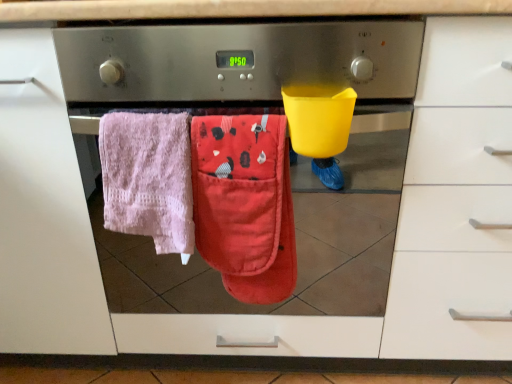
Describe the element at coordinates (244, 204) in the screenshot. I see `red cotton oven mitt at center, arranged as the first beach towel when viewed from the right` at that location.

In order to click on red cotton oven mitt at center, arranged as the first beach towel when viewed from the right in this screenshot , I will do `click(244, 204)`.

Based on the photo, measure the distance between pink terry cloth towel at left, marked as the 1th beach towel in a left-to-right arrangement, and camera.

pink terry cloth towel at left, marked as the 1th beach towel in a left-to-right arrangement, is 27.11 inches from camera.

What do you see at coordinates (148, 178) in the screenshot? I see `pink terry cloth towel at left, arranged as the second beach towel when viewed from the right` at bounding box center [148, 178].

The width and height of the screenshot is (512, 384). What are the coordinates of `pink terry cloth towel at left, marked as the 1th beach towel in a left-to-right arrangement` in the screenshot? It's located at (148, 178).

What is the approximate height of pink terry cloth towel at left, marked as the 1th beach towel in a left-to-right arrangement?

11.25 inches.

Where is `red cotton oven mitt at center, arranged as the first beach towel when viewed from the right`? red cotton oven mitt at center, arranged as the first beach towel when viewed from the right is located at coordinates (244, 204).

Considering the relative positions of red cotton oven mitt at center, arranged as the first beach towel when viewed from the right, and pink terry cloth towel at left, marked as the 1th beach towel in a left-to-right arrangement, in the image provided, is red cotton oven mitt at center, arranged as the first beach towel when viewed from the right, to the right of pink terry cloth towel at left, marked as the 1th beach towel in a left-to-right arrangement, from the viewer's perspective?

Indeed, red cotton oven mitt at center, arranged as the first beach towel when viewed from the right, is positioned on the right side of pink terry cloth towel at left, marked as the 1th beach towel in a left-to-right arrangement.

Is red cotton oven mitt at center, arranged as the first beach towel when viewed from the right, further to the viewer compared to pink terry cloth towel at left, arranged as the second beach towel when viewed from the right?

Yes, red cotton oven mitt at center, arranged as the first beach towel when viewed from the right, is further from the viewer.

Is point (270, 210) positioned before point (145, 163)?

That is False.

From the image's perspective, which is below, red cotton oven mitt at center, placed as the 2th beach towel when sorted from left to right, or pink terry cloth towel at left, arranged as the second beach towel when viewed from the right?

red cotton oven mitt at center, placed as the 2th beach towel when sorted from left to right, is shown below in the image.

From a real-world perspective, which object stands above the other?

pink terry cloth towel at left, arranged as the second beach towel when viewed from the right, is physically above.

In terms of width, does red cotton oven mitt at center, placed as the 2th beach towel when sorted from left to right, look wider or thinner when compared to pink terry cloth towel at left, marked as the 1th beach towel in a left-to-right arrangement?

Clearly, red cotton oven mitt at center, placed as the 2th beach towel when sorted from left to right, has less width compared to pink terry cloth towel at left, marked as the 1th beach towel in a left-to-right arrangement.

Who is shorter, red cotton oven mitt at center, arranged as the first beach towel when viewed from the right, or pink terry cloth towel at left, marked as the 1th beach towel in a left-to-right arrangement?

pink terry cloth towel at left, marked as the 1th beach towel in a left-to-right arrangement, is shorter.

Can you confirm if red cotton oven mitt at center, placed as the 2th beach towel when sorted from left to right, is bigger than pink terry cloth towel at left, arranged as the second beach towel when viewed from the right?

No.

Is red cotton oven mitt at center, placed as the 2th beach towel when sorted from left to right, inside or outside of pink terry cloth towel at left, arranged as the second beach towel when viewed from the right?

red cotton oven mitt at center, placed as the 2th beach towel when sorted from left to right, lies outside pink terry cloth towel at left, arranged as the second beach towel when viewed from the right.

Is the surface of red cotton oven mitt at center, placed as the 2th beach towel when sorted from left to right, in direct contact with pink terry cloth towel at left, marked as the 1th beach towel in a left-to-right arrangement?

Indeed, red cotton oven mitt at center, placed as the 2th beach towel when sorted from left to right, and pink terry cloth towel at left, marked as the 1th beach towel in a left-to-right arrangement, are beside each other and touching.

Is red cotton oven mitt at center, arranged as the first beach towel when viewed from the right, oriented away from pink terry cloth towel at left, marked as the 1th beach towel in a left-to-right arrangement?

No, red cotton oven mitt at center, arranged as the first beach towel when viewed from the right, is not facing the opposite direction of pink terry cloth towel at left, marked as the 1th beach towel in a left-to-right arrangement.

How different are the orientations of red cotton oven mitt at center, arranged as the first beach towel when viewed from the right, and pink terry cloth towel at left, marked as the 1th beach towel in a left-to-right arrangement, in degrees?

There is a 0.00223-degree angle between the facing directions of red cotton oven mitt at center, arranged as the first beach towel when viewed from the right, and pink terry cloth towel at left, marked as the 1th beach towel in a left-to-right arrangement.

Locate an element on the screen. beach towel on the left of red cotton oven mitt at center, arranged as the first beach towel when viewed from the right is located at coordinates (148, 178).

Is pink terry cloth towel at left, arranged as the second beach towel when viewed from the right, at the right side of red cotton oven mitt at center, arranged as the first beach towel when viewed from the right?

Incorrect, pink terry cloth towel at left, arranged as the second beach towel when viewed from the right, is not on the right side of red cotton oven mitt at center, arranged as the first beach towel when viewed from the right.

Which object is more forward, pink terry cloth towel at left, arranged as the second beach towel when viewed from the right, or red cotton oven mitt at center, placed as the 2th beach towel when sorted from left to right?

pink terry cloth towel at left, arranged as the second beach towel when viewed from the right, is more forward.

Considering the positions of points (142, 204) and (212, 177), is point (142, 204) farther from camera compared to point (212, 177)?

Yes, point (142, 204) is farther from viewer.

From the image's perspective, is pink terry cloth towel at left, marked as the 1th beach towel in a left-to-right arrangement, positioned above or below red cotton oven mitt at center, arranged as the first beach towel when viewed from the right?

Based on their image positions, pink terry cloth towel at left, marked as the 1th beach towel in a left-to-right arrangement, is located above red cotton oven mitt at center, arranged as the first beach towel when viewed from the right.

From a real-world perspective, who is located lower, pink terry cloth towel at left, arranged as the second beach towel when viewed from the right, or red cotton oven mitt at center, arranged as the first beach towel when viewed from the right?

In real-world perspective, red cotton oven mitt at center, arranged as the first beach towel when viewed from the right, is lower.

Can you confirm if pink terry cloth towel at left, arranged as the second beach towel when viewed from the right, is wider than red cotton oven mitt at center, placed as the 2th beach towel when sorted from left to right?

Yes, pink terry cloth towel at left, arranged as the second beach towel when viewed from the right, is wider than red cotton oven mitt at center, placed as the 2th beach towel when sorted from left to right.

Does pink terry cloth towel at left, arranged as the second beach towel when viewed from the right, have a greater height compared to red cotton oven mitt at center, arranged as the first beach towel when viewed from the right?

No.

Considering the relative sizes of pink terry cloth towel at left, marked as the 1th beach towel in a left-to-right arrangement, and red cotton oven mitt at center, placed as the 2th beach towel when sorted from left to right, in the image provided, is pink terry cloth towel at left, marked as the 1th beach towel in a left-to-right arrangement, smaller than red cotton oven mitt at center, placed as the 2th beach towel when sorted from left to right,?

No.

Would you say pink terry cloth towel at left, arranged as the second beach towel when viewed from the right, is inside or outside red cotton oven mitt at center, arranged as the first beach towel when viewed from the right?

pink terry cloth towel at left, arranged as the second beach towel when viewed from the right, cannot be found inside red cotton oven mitt at center, arranged as the first beach towel when viewed from the right.

Can you see pink terry cloth towel at left, marked as the 1th beach towel in a left-to-right arrangement, touching red cotton oven mitt at center, arranged as the first beach towel when viewed from the right?

Yes, pink terry cloth towel at left, marked as the 1th beach towel in a left-to-right arrangement, is beside red cotton oven mitt at center, arranged as the first beach towel when viewed from the right.

Is pink terry cloth towel at left, arranged as the second beach towel when viewed from the right, looking in the opposite direction of red cotton oven mitt at center, arranged as the first beach towel when viewed from the right?

No, red cotton oven mitt at center, arranged as the first beach towel when viewed from the right, is not at the back of pink terry cloth towel at left, arranged as the second beach towel when viewed from the right.

Identify the location of beach towel above the red cotton oven mitt at center, placed as the 2th beach towel when sorted from left to right (from a real-world perspective). (148, 178).

The image size is (512, 384). Find the location of `beach towel located in front of the red cotton oven mitt at center, arranged as the first beach towel when viewed from the right`. beach towel located in front of the red cotton oven mitt at center, arranged as the first beach towel when viewed from the right is located at coordinates (148, 178).

Where is `beach towel located below the pink terry cloth towel at left, arranged as the second beach towel when viewed from the right (from the image's perspective)`? The width and height of the screenshot is (512, 384). beach towel located below the pink terry cloth towel at left, arranged as the second beach towel when viewed from the right (from the image's perspective) is located at coordinates (244, 204).